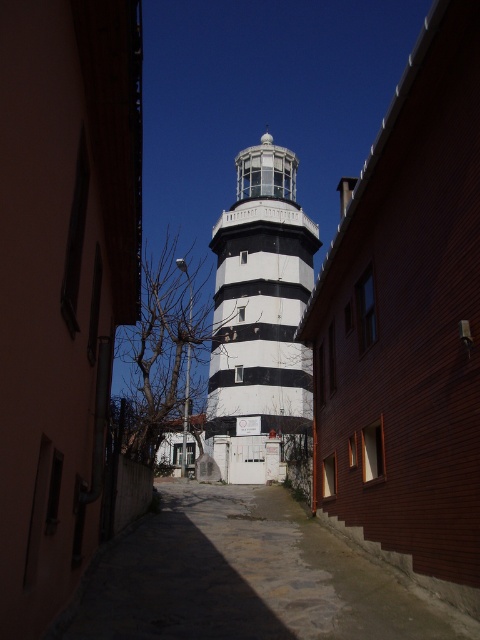
You are standing in the alleyway between the two buildings. There is a specific point marked at coordinates (249, 577). What is the surface texture of the ground at that point?

The point at coordinates (249, 577) corresponds to the smooth stone alley at center, so the surface texture there is smooth.

You are a delivery person with a cart that is 2 meters wide. You need to navigate through the narrow alleyway shown in the image. Can your cart fit between the smooth stone alley at center and the white painted concrete water tower at center?

The smooth stone alley at center and the white painted concrete water tower at center are 40.41 meters apart from each other, so yes, the cart can fit between them since the distance is much larger than the cart width.

You are a delivery person trying to navigate through the narrow alleyway. You need to pass between the smooth stone alley at center and the white painted concrete water tower at center. Which side should you go to avoid hitting the water tower?

You should go to the left side of the white painted concrete water tower at center since the smooth stone alley at center is located to the left of it, providing a clear path around the water tower.